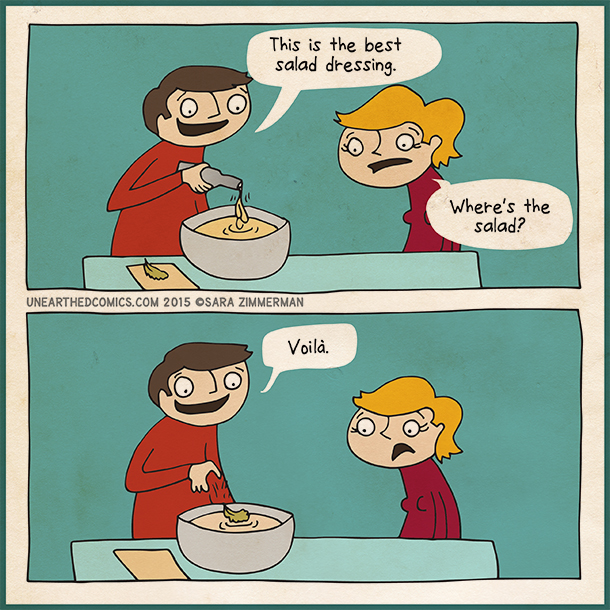
This screenshot has width=610, height=610. What are the coordinates of `table` in the screenshot? It's located at (335, 554), (382, 271).